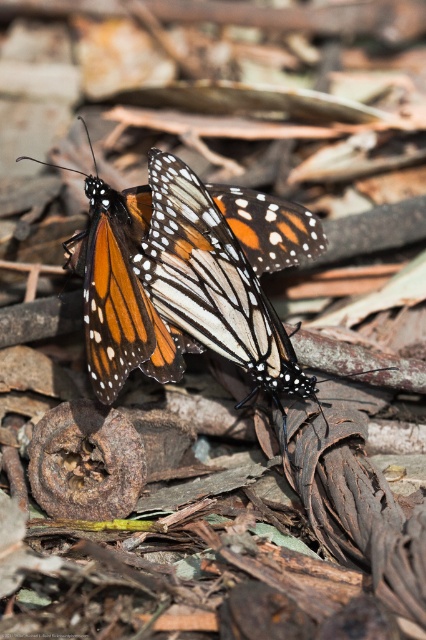
Can you confirm if orange and white butterfly at center is taller than orange and white spotted butterfly at center?

No.

Between point (255, 214) and point (207, 227), which one is positioned behind?

Positioned behind is point (255, 214).

Where is `orange and white butterfly at center`? orange and white butterfly at center is located at coordinates (121, 292).